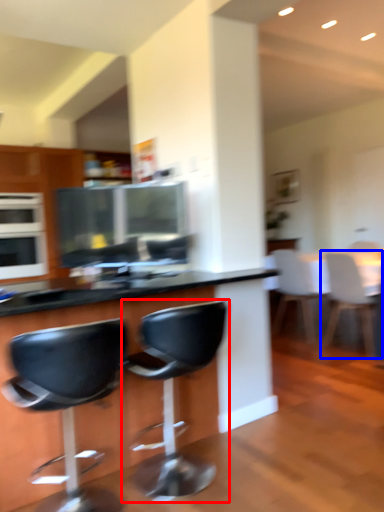
Question: Which of the following is the farthest to the observer, chair (highlighted by a red box) or chair (highlighted by a blue box)?

Choices:
 (A) chair
 (B) chair

Answer: (B)